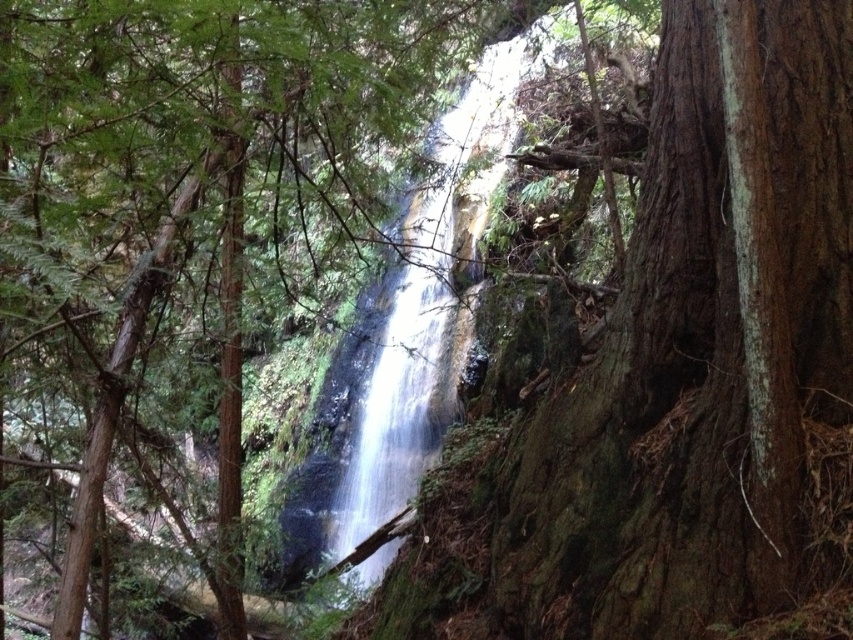
Question: Is white smooth waterfall at center thinner than green rough bark tree at center?

Choices:
 (A) yes
 (B) no

Answer: (A)

Question: Among these points, which one is nearest to the camera?

Choices:
 (A) (474, 99)
 (B) (515, 19)

Answer: (B)

Question: Is white smooth waterfall at center wider than green rough bark tree at center?

Choices:
 (A) yes
 (B) no

Answer: (B)

Question: Is white smooth waterfall at center below green rough bark tree at center?

Choices:
 (A) no
 (B) yes

Answer: (A)